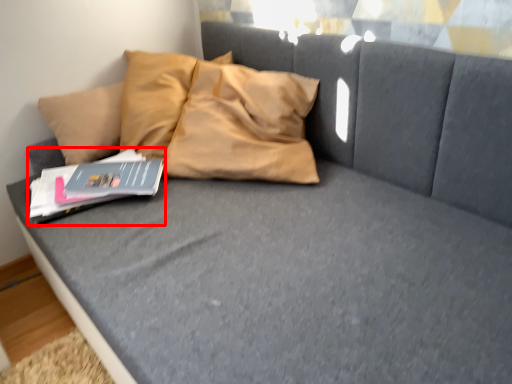
Question: From the image's perspective, where is paperback book (annotated by the red box) located in relation to paperback book in the image?

Choices:
 (A) above
 (B) below

Answer: (B)